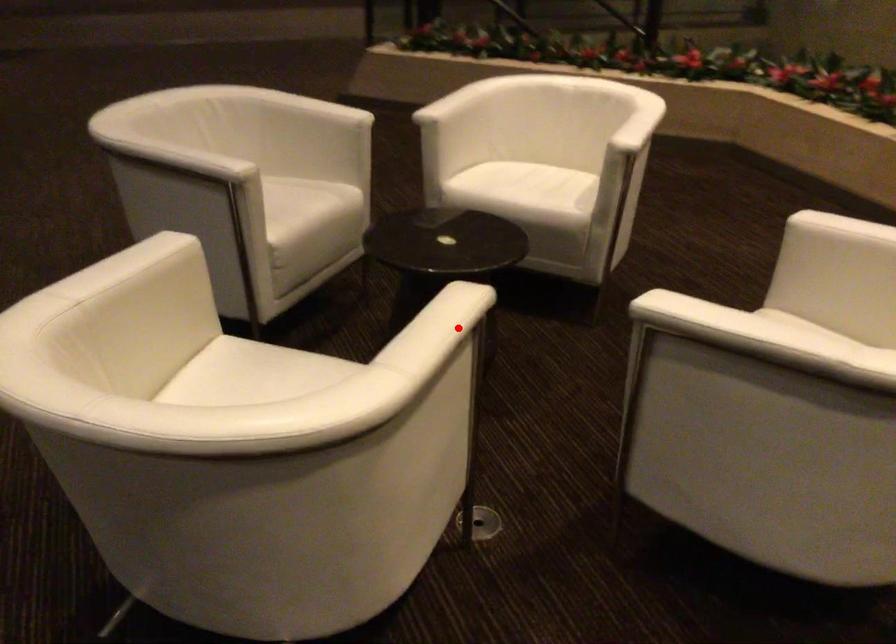
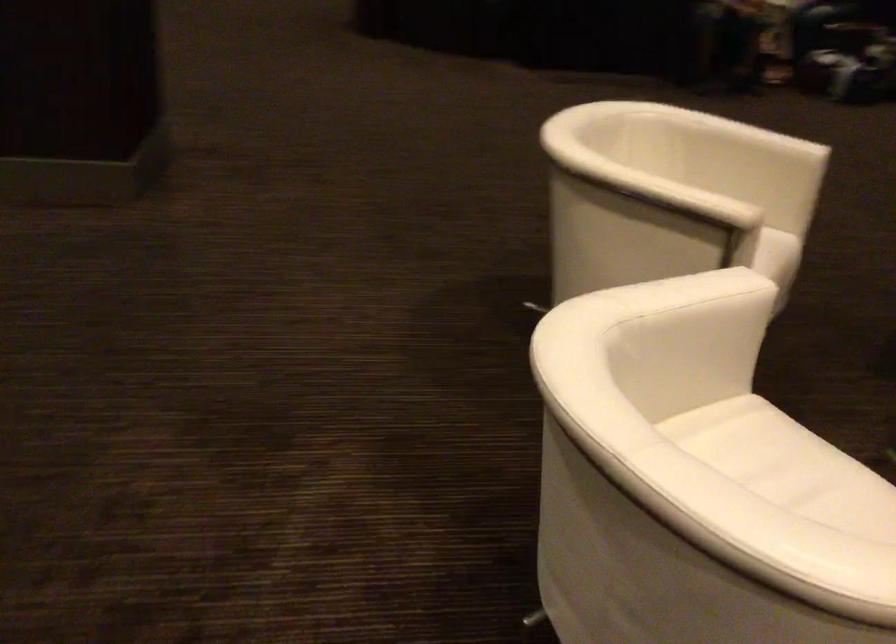
The point at the highlighted location is marked in the first image. Where is the corresponding point in the second image?

(675, 194)